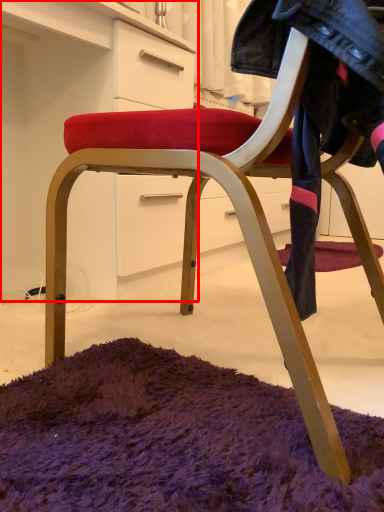
Question: From the image's perspective, where is dresser (annotated by the red box) located in relation to clothing in the image?

Choices:
 (A) above
 (B) below

Answer: (A)